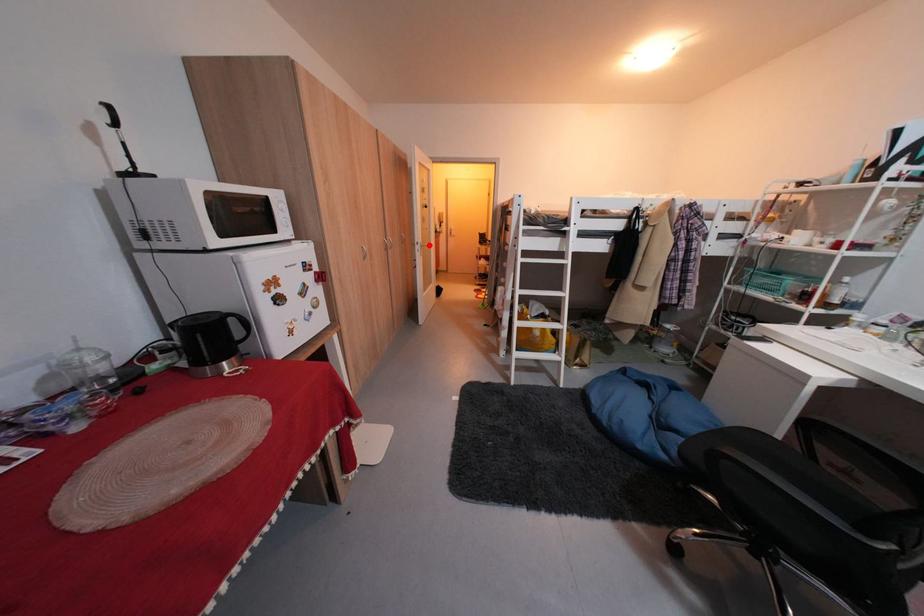
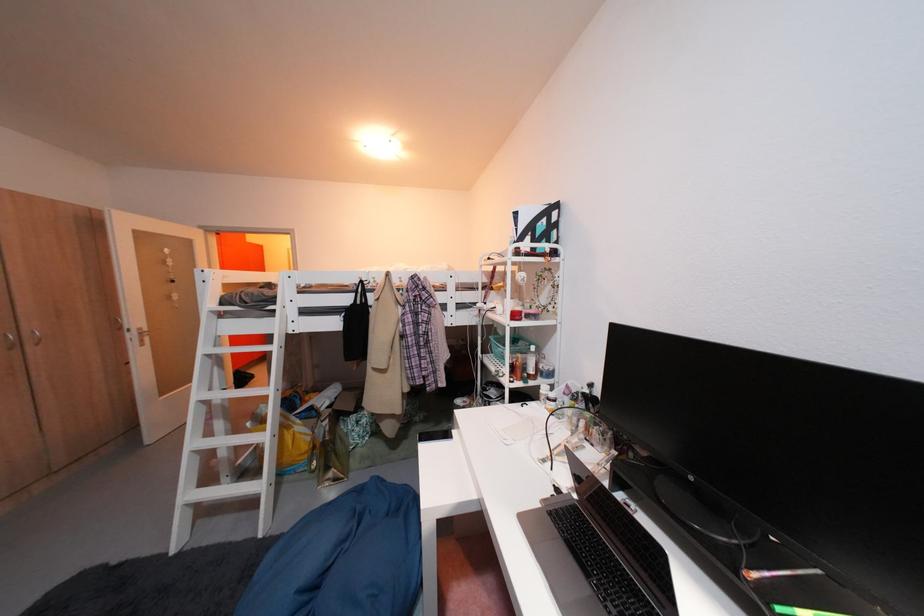
Question: I am providing you with two images of the same scene from different viewpoints. In image1, a red point is highlighted. Considering the same 3D point in image2, which of the following is correct?

Choices:
 (A) It is closer
 (B) It is farther

Answer: (B)